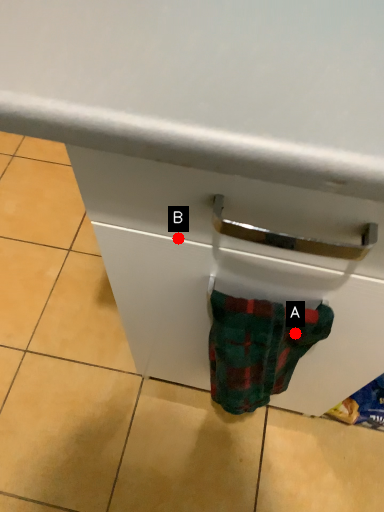
Question: Two points are circled on the image, labeled by A and B beside each circle. Which point is closer to the camera taking this photo?

Choices:
 (A) A is closer
 (B) B is closer

Answer: (B)